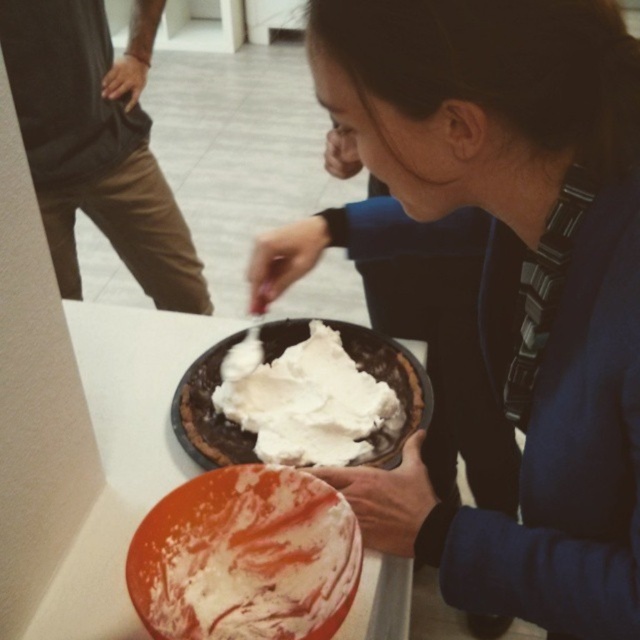
Question: From the image, what is the correct spatial relationship of white creamy cake at lower center in relation to white fluffy frosting at center?

Choices:
 (A) below
 (B) above

Answer: (A)

Question: Which object is the farthest from the brown cotton pants at left?

Choices:
 (A) white fluffy frosting at center
 (B) white creamy cake at lower center

Answer: (B)

Question: Which object is positioned farthest from the brown cotton pants at left?

Choices:
 (A) white creamy cake at lower center
 (B) white fluffy frosting at center

Answer: (A)

Question: Which object is positioned closest to the brown cotton pants at left?

Choices:
 (A) white fluffy frosting at center
 (B) white creamy cake at lower center

Answer: (A)

Question: Can you confirm if brown cotton pants at left is thinner than white fluffy frosting at center?

Choices:
 (A) yes
 (B) no

Answer: (B)

Question: Does brown cotton pants at left have a greater width compared to white creamy cake at lower center?

Choices:
 (A) no
 (B) yes

Answer: (B)